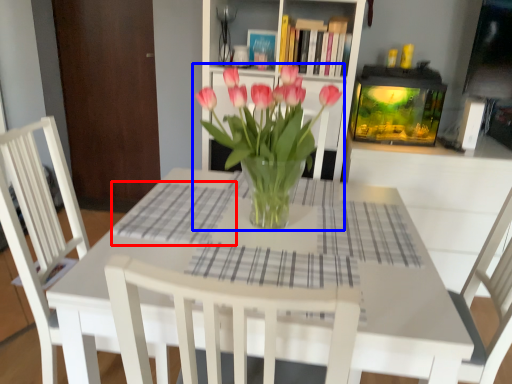
Question: Which of the following is the closest to the observer, plaid (highlighted by a red box) or houseplant (highlighted by a blue box)?

Choices:
 (A) plaid
 (B) houseplant

Answer: (B)